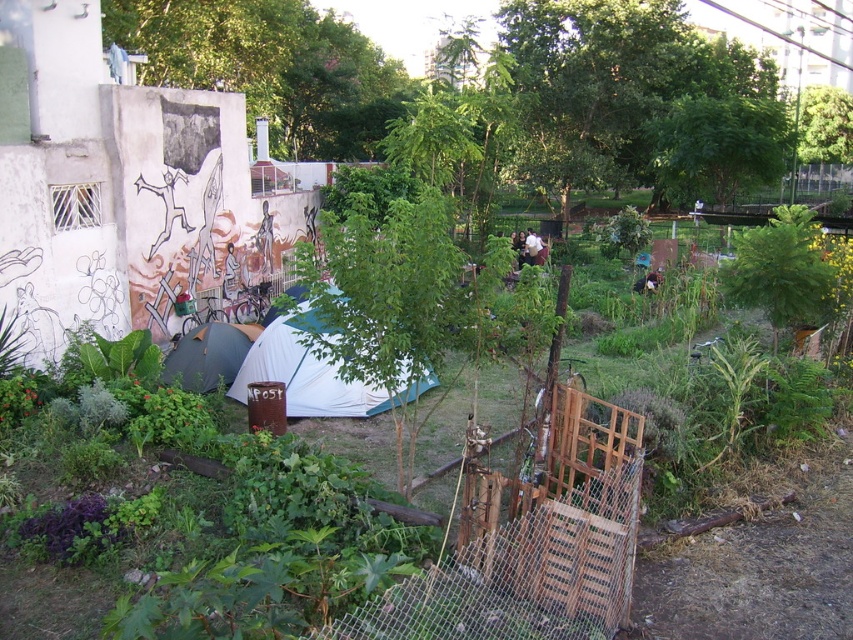
Question: Among these objects, which one is nearest to the camera?

Choices:
 (A) white fabric tent at center
 (B) white fabric at center

Answer: (A)

Question: Which object is farther from the camera taking this photo?

Choices:
 (A) white fabric tent at center
 (B) white fabric at center
 (C) dark blue tarp at center

Answer: (B)

Question: Which of these objects is positioned closest to the white fabric tent at center?

Choices:
 (A) white fabric at center
 (B) dark blue tarp at center

Answer: (B)

Question: Observing the image, what is the correct spatial positioning of white fabric tent at center in reference to dark blue tarp at center?

Choices:
 (A) above
 (B) below

Answer: (B)

Question: Is white fabric tent at center bigger than white fabric at center?

Choices:
 (A) no
 (B) yes

Answer: (A)

Question: Can you confirm if white fabric tent at center is positioned below white fabric at center?

Choices:
 (A) no
 (B) yes

Answer: (B)